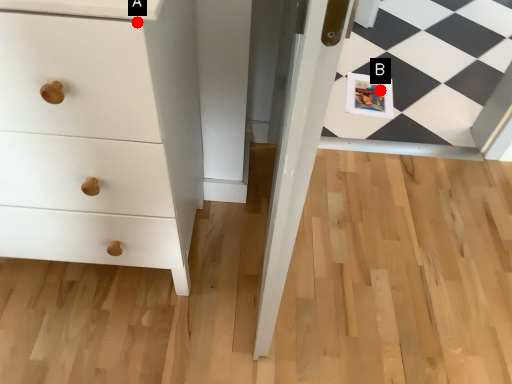
Question: Two points are circled on the image, labeled by A and B beside each circle. Which point appears farthest from the camera in this image?

Choices:
 (A) A is further
 (B) B is further

Answer: (B)